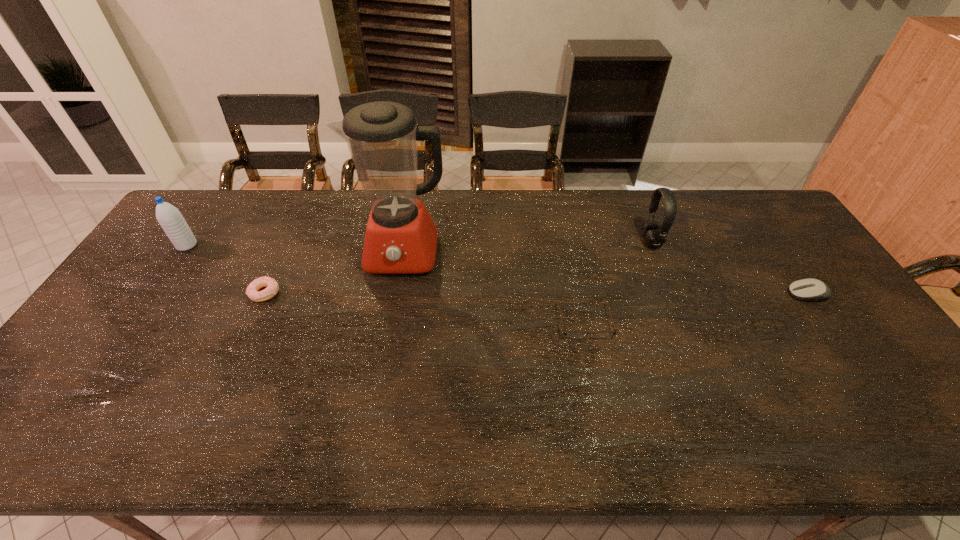
Identify the location of the tallest object. (401, 238).

Where is `blender`? This screenshot has width=960, height=540. blender is located at coordinates (401, 238).

Find the location of `headset`. headset is located at coordinates (653, 234).

Locate an element on the screen. The height and width of the screenshot is (540, 960). water bottle is located at coordinates (169, 217).

I want to click on computer equipment, so click(806, 289).

Locate an element on the screen. the rightmost object is located at coordinates (806, 289).

Identify the location of the fifth object from right to left. This screenshot has height=540, width=960. (272, 286).

The width and height of the screenshot is (960, 540). I want to click on spectacles, so click(x=571, y=334).

Image resolution: width=960 pixels, height=540 pixels. In order to click on vacant space located 0.290m on the front of the blender near the controls in this screenshot , I will do `click(385, 363)`.

Where is `vacant space situated 0.060m on the front-facing side of the fifth object from left to right`? This screenshot has height=540, width=960. vacant space situated 0.060m on the front-facing side of the fifth object from left to right is located at coordinates (623, 241).